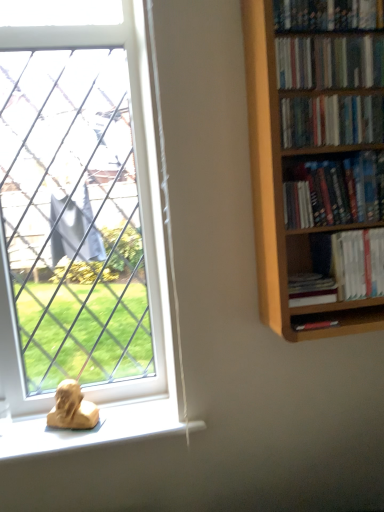
The height and width of the screenshot is (512, 384). Describe the element at coordinates (329, 62) in the screenshot. I see `hardcover books at upper right, positioned as the 2th book in top-to-bottom order` at that location.

Find the location of a particular element. This screenshot has height=512, width=384. hardcover books at upper right, acting as the 3th book starting from the top is located at coordinates [x=331, y=121].

The height and width of the screenshot is (512, 384). What do you see at coordinates (335, 192) in the screenshot?
I see `hardcover books at upper right, the third book in the bottom-to-top sequence` at bounding box center [335, 192].

The width and height of the screenshot is (384, 512). What are the coordinates of `hardcover book at right, which is counted as the 1th book, starting from the bottom` in the screenshot? It's located at (311, 289).

What do you see at coordinates (311, 289) in the screenshot? The image size is (384, 512). I see `hardcover book at right, which is counted as the 1th book, starting from the bottom` at bounding box center [311, 289].

Find the location of a particular element. Image resolution: width=384 pixels, height=512 pixels. hardcover books at upper right, positioned as the 5th book in bottom-to-top order is located at coordinates (329, 62).

Locate an element on the screen. The width and height of the screenshot is (384, 512). window lying behind the hardcover books at upper right, positioned as the 2th book in top-to-bottom order is located at coordinates (84, 232).

Based on the photo, considering the relative sizes of white plastic window at lower left and hardcover books at upper right, positioned as the 2th book in top-to-bottom order, in the image provided, is white plastic window at lower left taller than hardcover books at upper right, positioned as the 2th book in top-to-bottom order,?

Yes.

Is point (73, 64) closer or farther from the camera than point (335, 48)?

Point (73, 64) is positioned farther from the camera compared to point (335, 48).

Can you confirm if white plastic window at lower left is wider than hardcover books at upper right, positioned as the 2th book in top-to-bottom order?

Yes, white plastic window at lower left is wider than hardcover books at upper right, positioned as the 2th book in top-to-bottom order.

Considering the relative sizes of hardcover books at upper right, positioned as the 5th book in bottom-to-top order, and white paperbacks at center-right, the second book when ordered from bottom to top, in the image provided, is hardcover books at upper right, positioned as the 5th book in bottom-to-top order, taller than white paperbacks at center-right, the second book when ordered from bottom to top,?

Incorrect, the height of hardcover books at upper right, positioned as the 5th book in bottom-to-top order, is not larger of that of white paperbacks at center-right, the second book when ordered from bottom to top.

Is hardcover books at upper right, positioned as the 5th book in bottom-to-top order, next to white paperbacks at center-right, the second book when ordered from bottom to top?

No.

From the picture: Is hardcover books at upper right, positioned as the 2th book in top-to-bottom order, facing away from white paperbacks at center-right, which is counted as the fifth book, starting from the top?

No, hardcover books at upper right, positioned as the 2th book in top-to-bottom order, is not facing away from white paperbacks at center-right, which is counted as the fifth book, starting from the top.

Is white paperbacks at center-right, which is counted as the fifth book, starting from the top, turned away from hardcover book at right, arranged as the sixth book when viewed from the top?

No, white paperbacks at center-right, which is counted as the fifth book, starting from the top, is not facing away from hardcover book at right, arranged as the sixth book when viewed from the top.

Can you confirm if white paperbacks at center-right, which is counted as the fifth book, starting from the top, is taller than hardcover book at right, which is counted as the 1th book, starting from the bottom?

Yes.

Does white paperbacks at center-right, the second book when ordered from bottom to top, have a lesser width compared to hardcover book at right, which is counted as the 1th book, starting from the bottom?

Indeed, white paperbacks at center-right, the second book when ordered from bottom to top, has a lesser width compared to hardcover book at right, which is counted as the 1th book, starting from the bottom.

Considering the relative sizes of wooden bookcase at right and white paperbacks at center-right, which is counted as the fifth book, starting from the top, in the image provided, is wooden bookcase at right taller than white paperbacks at center-right, which is counted as the fifth book, starting from the top,?

Yes, wooden bookcase at right is taller than white paperbacks at center-right, which is counted as the fifth book, starting from the top.

What's the angular difference between wooden bookcase at right and white paperbacks at center-right, which is counted as the fifth book, starting from the top,'s facing directions?

0.318 degrees.

Is wooden bookcase at right turned away from white paperbacks at center-right, which is counted as the fifth book, starting from the top?

Yes.

Is point (266, 254) less distant than point (346, 275)?

Yes, point (266, 254) is closer to viewer.

Based on the photo, from a real-world perspective, which is physically below, matte yellow sculpture at lower left or hardcover book at right, arranged as the sixth book when viewed from the top?

From a 3D spatial view, matte yellow sculpture at lower left is below.

Does point (59, 405) come behind point (303, 300)?

Yes, point (59, 405) is farther from viewer.

Is matte yellow sculpture at lower left facing towards hardcover book at right, which is counted as the 1th book, starting from the bottom?

No, matte yellow sculpture at lower left does not turn towards hardcover book at right, which is counted as the 1th book, starting from the bottom.

From the image's perspective, is matte yellow sculpture at lower left located beneath hardcover book at right, which is counted as the 1th book, starting from the bottom?

Yes, from the image's perspective, matte yellow sculpture at lower left is below hardcover book at right, which is counted as the 1th book, starting from the bottom.

Between hardcover books at upper right, which is counted as the 6th book, starting from the bottom, and white plastic window at lower left, which one has larger size?

white plastic window at lower left is bigger.

Is hardcover books at upper right, the 1th book positioned from the top, at the right side of white plastic window at lower left?

Yes, hardcover books at upper right, the 1th book positioned from the top, is to the right of white plastic window at lower left.

Does point (316, 14) come behind point (81, 144)?

No, it is in front of (81, 144).

From a real-world perspective, which is physically below, hardcover books at upper right, which is counted as the 6th book, starting from the bottom, or white plastic window at lower left?

white plastic window at lower left.

Which is more to the left, hardcover books at upper right, positioned as the 2th book in top-to-bottom order, or hardcover book at right, which is counted as the 1th book, starting from the bottom?

hardcover book at right, which is counted as the 1th book, starting from the bottom.

Looking at their sizes, would you say hardcover books at upper right, positioned as the 5th book in bottom-to-top order, is wider or thinner than hardcover book at right, arranged as the sixth book when viewed from the top?

hardcover books at upper right, positioned as the 5th book in bottom-to-top order, is thinner than hardcover book at right, arranged as the sixth book when viewed from the top.

Is hardcover book at right, arranged as the sixth book when viewed from the top, at the back of hardcover books at upper right, positioned as the 5th book in bottom-to-top order?

hardcover books at upper right, positioned as the 5th book in bottom-to-top order, does not have its back to hardcover book at right, arranged as the sixth book when viewed from the top.

Which is behind, point (318, 40) or point (331, 284)?

Positioned behind is point (331, 284).

I want to click on the 3rd book to the right of the white plastic window at lower left, counting from the anchor's position, so click(x=329, y=62).

This screenshot has width=384, height=512. In order to click on book that is the 4th object located behind the hardcover books at upper right, positioned as the 5th book in bottom-to-top order in this screenshot , I will do `click(345, 268)`.

From the picture: Which object lies nearer to the anchor point hardcover books at upper right, the third book in the bottom-to-top sequence, white plastic window at lower left or wooden bookcase at right?

wooden bookcase at right.

When comparing their distances from hardcover books at upper right, the third book in the bottom-to-top sequence, does matte yellow sculpture at lower left or hardcover books at upper right, which is counted as the 6th book, starting from the bottom, seem closer?

The object closer to hardcover books at upper right, the third book in the bottom-to-top sequence, is hardcover books at upper right, which is counted as the 6th book, starting from the bottom.

Estimate the real-world distances between objects in this image. Which object is further from wooden bookcase at right, hardcover books at upper right, acting as the 3th book starting from the top, or hardcover book at right, which is counted as the 1th book, starting from the bottom?

hardcover book at right, which is counted as the 1th book, starting from the bottom, is further to wooden bookcase at right.

When comparing their distances from wooden bookcase at right, does hardcover books at upper right, acting as the 3th book starting from the top, or hardcover books at upper right, the fourth book positioned from the top, seem closer?

hardcover books at upper right, the fourth book positioned from the top, is closer to wooden bookcase at right.

Looking at the image, which one is located further to white plastic window at lower left, hardcover books at upper right, which appears as the fourth book when ordered from the bottom, or hardcover books at upper right, positioned as the 5th book in bottom-to-top order?

hardcover books at upper right, positioned as the 5th book in bottom-to-top order, lies further to white plastic window at lower left than the other object.

Estimate the real-world distances between objects in this image. Which object is closer to hardcover books at upper right, positioned as the 5th book in bottom-to-top order, matte yellow sculpture at lower left or white plastic window at lower left?

matte yellow sculpture at lower left.

Consider the image. When comparing their distances from matte yellow sculpture at lower left, does hardcover book at right, which is counted as the 1th book, starting from the bottom, or white paperbacks at center-right, the second book when ordered from bottom to top, seem closer?

The object closer to matte yellow sculpture at lower left is hardcover book at right, which is counted as the 1th book, starting from the bottom.

Which object lies nearer to the anchor point wooden bookcase at right, hardcover books at upper right, the 1th book positioned from the top, or hardcover books at upper right, the third book in the bottom-to-top sequence?

hardcover books at upper right, the third book in the bottom-to-top sequence, is closer to wooden bookcase at right.

You are a GUI agent. You are given a task and a screenshot of the screen. Output one action in this format:
    pyautogui.click(x=<x>, y=<y>)
    Task: Click on the book between hardcover books at upper right, positioned as the 2th book in top-to-bottom order, and wooden bookcase at right from top to bottom
    The width and height of the screenshot is (384, 512).
    Given the screenshot: What is the action you would take?
    pyautogui.click(x=331, y=121)

Image resolution: width=384 pixels, height=512 pixels. Find the location of `book between hardcover books at upper right, which is counted as the 6th book, starting from the bottom, and hardcover books at upper right, acting as the 3th book starting from the top, from top to bottom`. book between hardcover books at upper right, which is counted as the 6th book, starting from the bottom, and hardcover books at upper right, acting as the 3th book starting from the top, from top to bottom is located at coordinates (329, 62).

The image size is (384, 512). Find the location of `sculpture between white plastic window at lower left and wooden bookcase at right from left to right`. sculpture between white plastic window at lower left and wooden bookcase at right from left to right is located at coordinates (72, 408).

Find the location of a particular element. This screenshot has height=512, width=384. bookcase that lies between hardcover books at upper right, which is counted as the 6th book, starting from the bottom, and white paperbacks at center-right, which is counted as the fifth book, starting from the top, from top to bottom is located at coordinates (282, 191).